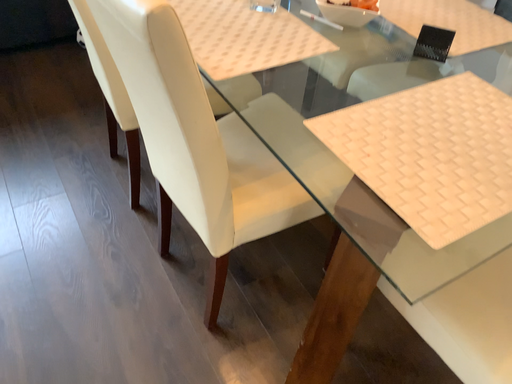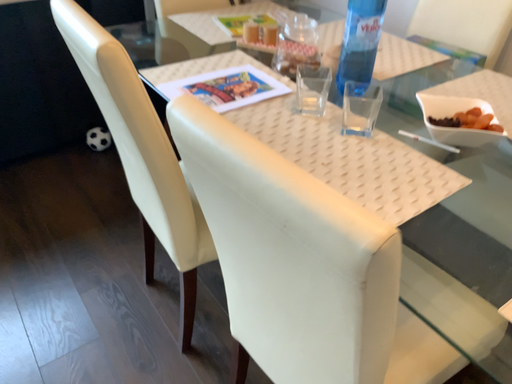
Question: Which way did the camera rotate in the video?

Choices:
 (A) rotated upward
 (B) rotated downward

Answer: (A)